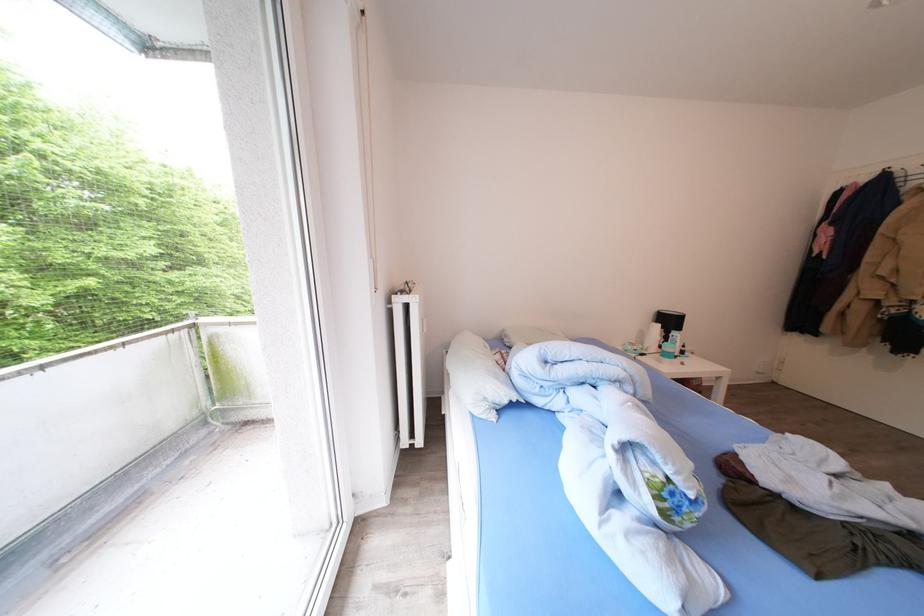
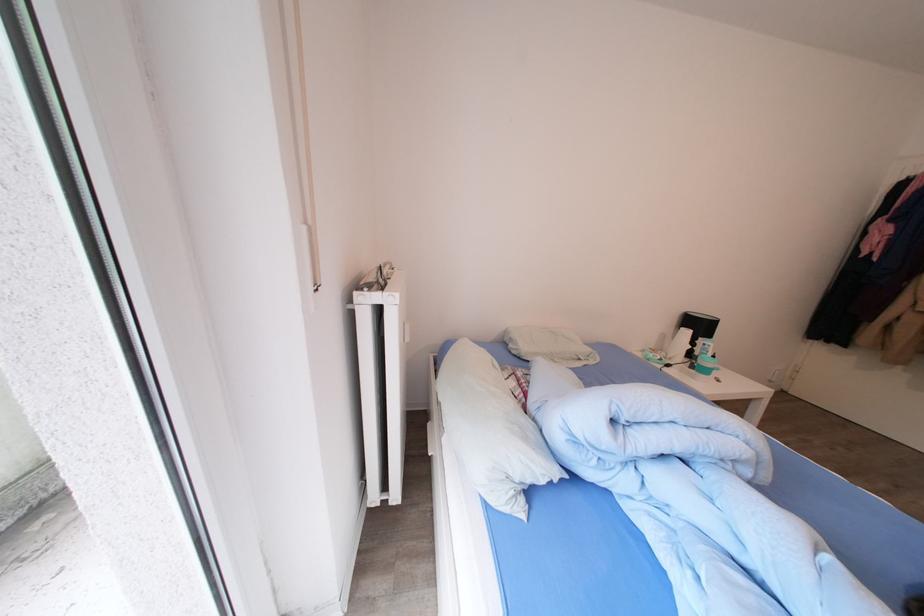
Locate, in the second image, the point that corresponds to pixel 677 326 in the first image.

(708, 331)